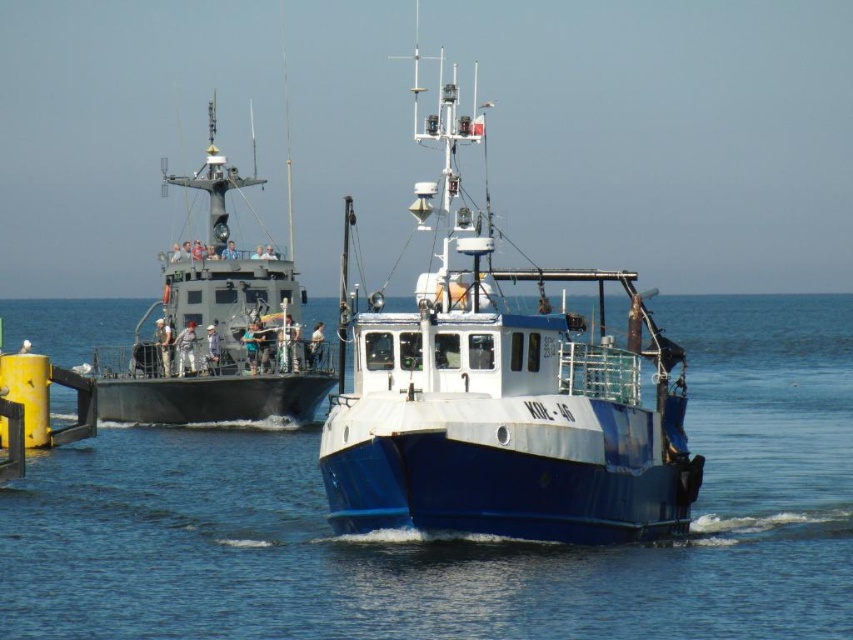
Question: Considering the real-world distances, which object is farthest from the blue matte boat at center?

Choices:
 (A) blue water at center
 (B) matte gray boat at left

Answer: (B)

Question: Which point appears closest to the camera in this image?

Choices:
 (A) (354, 332)
 (B) (212, 320)

Answer: (A)

Question: Which of the following is the closest to the observer?

Choices:
 (A) blue water at center
 (B) matte gray boat at left
 (C) blue matte boat at center

Answer: (A)

Question: Can you confirm if blue water at center is positioned below matte gray boat at left?

Choices:
 (A) no
 (B) yes

Answer: (B)

Question: Considering the relative positions of blue water at center and matte gray boat at left in the image provided, where is blue water at center located with respect to matte gray boat at left?

Choices:
 (A) right
 (B) left

Answer: (A)

Question: Can you confirm if blue water at center is bigger than blue matte boat at center?

Choices:
 (A) yes
 (B) no

Answer: (A)